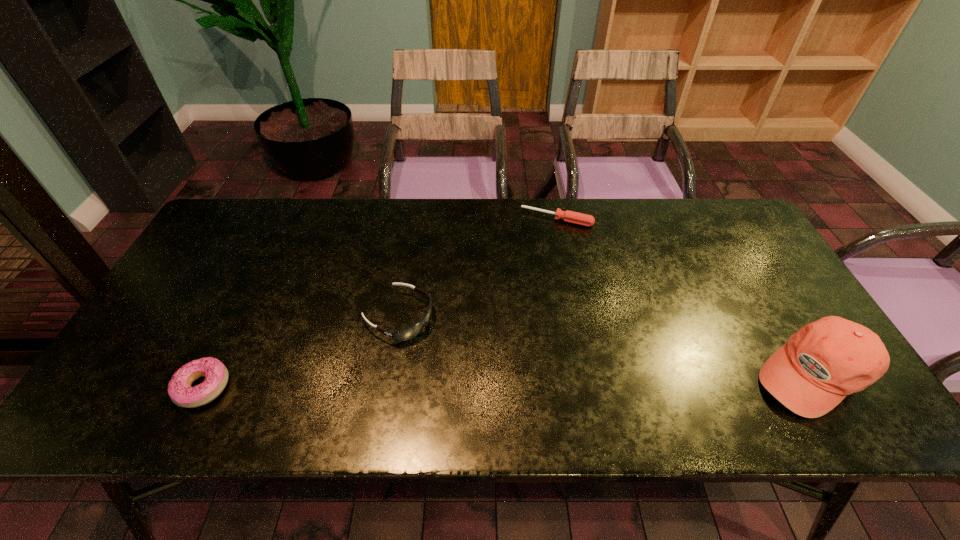
Where is `vacant spot on the desktop that is between the leftmost object and the baseball cap and is positioned at the tip of the shortest object`? The image size is (960, 540). vacant spot on the desktop that is between the leftmost object and the baseball cap and is positioned at the tip of the shortest object is located at coordinates (492, 381).

At what (x,y) coordinates should I click in order to perform the action: click on free space on the desktop that is between the doughnut and the baseball cap and is positioned on the front and sides of the third object from right to left. Please return your answer as a coordinate pair (x, y). The width and height of the screenshot is (960, 540). Looking at the image, I should click on (519, 380).